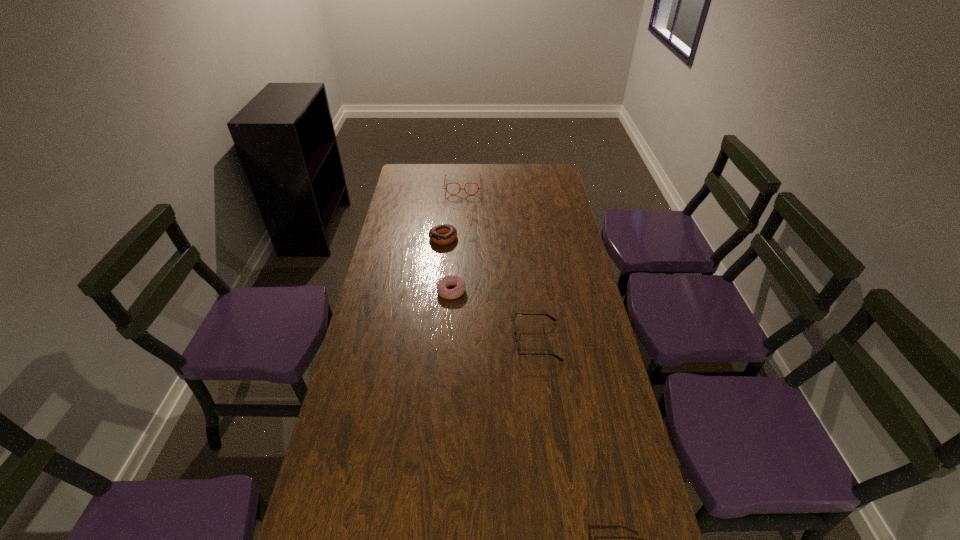
Identify the location of the tallest object. The width and height of the screenshot is (960, 540). (445, 175).

Identify the location of the farther spectacles. (445, 175).

Find the location of a particular element. the second farthest object is located at coordinates (443, 234).

This screenshot has height=540, width=960. In order to click on the nearer doughnut in this screenshot , I will do `click(446, 281)`.

Locate an element on the screen. the shorter doughnut is located at coordinates (446, 281).

Locate an element on the screen. The height and width of the screenshot is (540, 960). the nearer spectacles is located at coordinates pyautogui.click(x=517, y=351).

This screenshot has width=960, height=540. What are the coordinates of `the shorter spectacles` in the screenshot? It's located at (517, 351).

Locate an element on the screen. vacant space located 0.390m on the front-facing side of the farthest object is located at coordinates [460, 247].

You are a GUI agent. You are given a task and a screenshot of the screen. Output one action in this format:
    pyautogui.click(x=<x>, y=<y>)
    Task: Click on the free spot located on the front of the farther doughnut
    Image resolution: width=960 pixels, height=540 pixels.
    Given the screenshot: What is the action you would take?
    pyautogui.click(x=440, y=274)

The image size is (960, 540). What are the coordinates of `free region located 0.220m on the left of the nearer doughnut` in the screenshot? It's located at (375, 292).